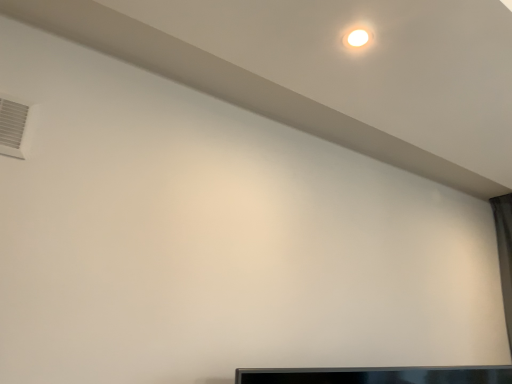
Question: Is black glossy tv at lower center closer to the viewer compared to white plastic air conditioning at upper left?

Choices:
 (A) yes
 (B) no

Answer: (B)

Question: Does black glossy tv at lower center have a lesser height compared to white plastic air conditioning at upper left?

Choices:
 (A) yes
 (B) no

Answer: (A)

Question: Is black glossy tv at lower center aimed at white plastic air conditioning at upper left?

Choices:
 (A) no
 (B) yes

Answer: (A)

Question: Can you confirm if black glossy tv at lower center is thinner than white plastic air conditioning at upper left?

Choices:
 (A) no
 (B) yes

Answer: (A)

Question: Could white plastic air conditioning at upper left be considered to be inside black glossy tv at lower center?

Choices:
 (A) no
 (B) yes

Answer: (A)

Question: Does black glossy tv at lower center appear on the right side of white plastic air conditioning at upper left?

Choices:
 (A) no
 (B) yes

Answer: (B)

Question: Does white plastic air conditioning at upper left come in front of black glossy tv at lower center?

Choices:
 (A) no
 (B) yes

Answer: (B)

Question: From a real-world perspective, is white plastic air conditioning at upper left located beneath black glossy tv at lower center?

Choices:
 (A) no
 (B) yes

Answer: (A)

Question: Is white plastic air conditioning at upper left turned away from black glossy tv at lower center?

Choices:
 (A) no
 (B) yes

Answer: (A)

Question: Are white plastic air conditioning at upper left and black glossy tv at lower center far apart?

Choices:
 (A) yes
 (B) no

Answer: (A)

Question: Can we say white plastic air conditioning at upper left lies outside black glossy tv at lower center?

Choices:
 (A) yes
 (B) no

Answer: (A)

Question: Can you confirm if white plastic air conditioning at upper left is shorter than black glossy tv at lower center?

Choices:
 (A) yes
 (B) no

Answer: (B)

Question: Considering the positions of white plastic air conditioning at upper left and black glossy tv at lower center in the image, is white plastic air conditioning at upper left wider or thinner than black glossy tv at lower center?

Choices:
 (A) wide
 (B) thin

Answer: (B)